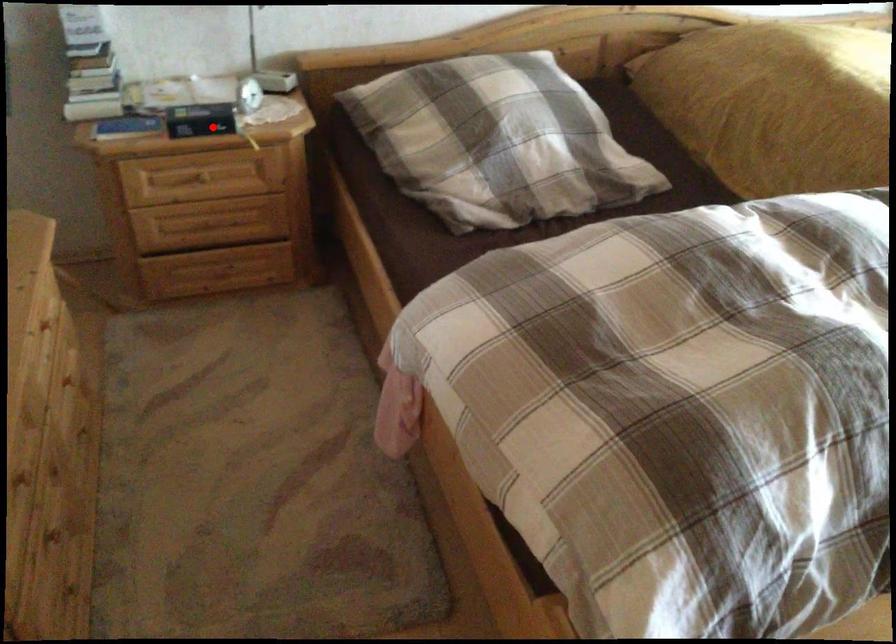
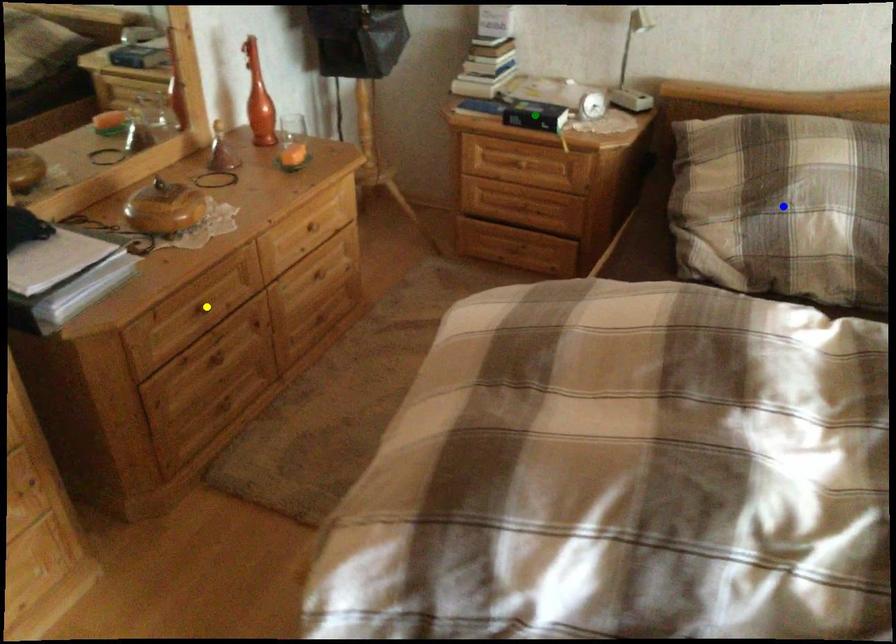
Question: I am providing you with two images of the same scene from different viewpoints. A red point is marked on the first image. You are given multiple points on the second image. Which spot in image 2 lines up with the point in image 1?

Choices:
 (A) green point
 (B) blue point
 (C) yellow point

Answer: (A)